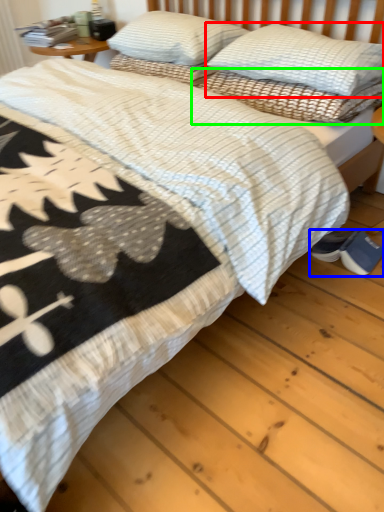
Question: Based on their relative distances, which object is nearer to pillow (highlighted by a red box)? Choose from footwear (highlighted by a blue box) and pillow (highlighted by a green box).

Choices:
 (A) footwear
 (B) pillow

Answer: (B)